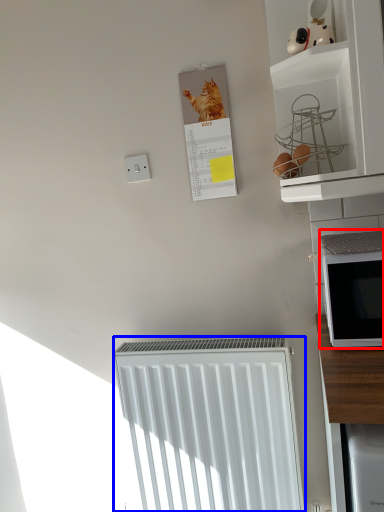
Question: Which point is closer to the camera, microwave oven (highlighted by a red box) or radiator (highlighted by a blue box)?

Choices:
 (A) microwave oven
 (B) radiator

Answer: (A)